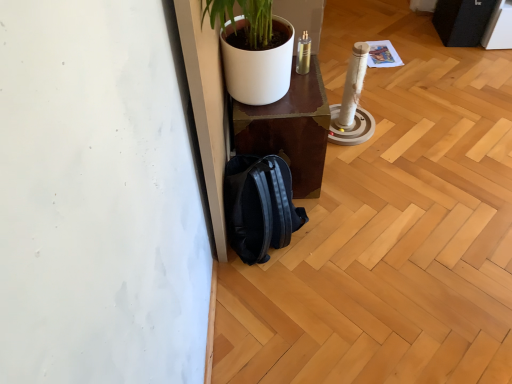
In order to click on vacant area that is situated to the right of shiny brown table at center in this screenshot , I will do `click(371, 173)`.